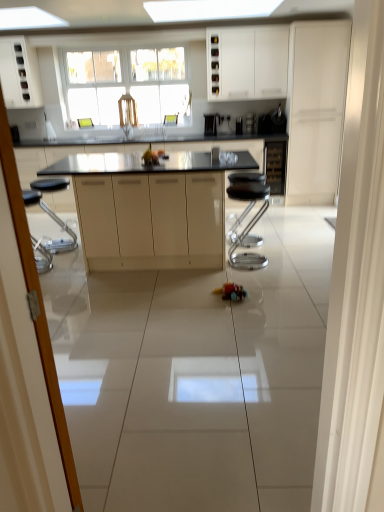
Question: Is white matte cabinet at upper left, placed as the first cabinetry when sorted from left to right, at the right side of white matte cabinet at right, which is the 1th cabinetry in right-to-left order?

Choices:
 (A) no
 (B) yes

Answer: (A)

Question: Does white matte cabinet at upper left, the 5th cabinetry positioned from the right, have a greater width compared to white matte cabinet at right, which ranks as the 5th cabinetry in left-to-right order?

Choices:
 (A) yes
 (B) no

Answer: (B)

Question: Is white matte cabinet at upper left, placed as the first cabinetry when sorted from left to right, taller than white matte cabinet at right, which is the 1th cabinetry in right-to-left order?

Choices:
 (A) yes
 (B) no

Answer: (B)

Question: Are white matte cabinet at upper left, the 5th cabinetry positioned from the right, and white matte cabinet at right, which ranks as the 5th cabinetry in left-to-right order, beside each other?

Choices:
 (A) no
 (B) yes

Answer: (A)

Question: Is white matte cabinet at upper left, placed as the first cabinetry when sorted from left to right, shorter than white matte cabinet at right, which is the 1th cabinetry in right-to-left order?

Choices:
 (A) no
 (B) yes

Answer: (B)

Question: From a real-world perspective, does white matte cabinet at upper left, the 5th cabinetry positioned from the right, stand above white matte cabinet at right, which is the 1th cabinetry in right-to-left order?

Choices:
 (A) no
 (B) yes

Answer: (B)

Question: From a real-world perspective, is matte beige cabinetry at center, the 4th cabinetry in the right-to-left sequence, positioned over transparent glass screen door at left based on gravity?

Choices:
 (A) yes
 (B) no

Answer: (B)

Question: From a real-world perspective, is matte beige cabinetry at center, arranged as the 2th cabinetry when viewed from the left, positioned under transparent glass screen door at left based on gravity?

Choices:
 (A) no
 (B) yes

Answer: (B)

Question: Considering the relative positions of matte beige cabinetry at center, arranged as the 2th cabinetry when viewed from the left, and transparent glass screen door at left in the image provided, is matte beige cabinetry at center, arranged as the 2th cabinetry when viewed from the left, in front of transparent glass screen door at left?

Choices:
 (A) no
 (B) yes

Answer: (A)

Question: Is transparent glass screen door at left surrounded by matte beige cabinetry at center, arranged as the 2th cabinetry when viewed from the left?

Choices:
 (A) yes
 (B) no

Answer: (B)

Question: From the image's perspective, is matte beige cabinetry at center, arranged as the 2th cabinetry when viewed from the left, located above transparent glass screen door at left?

Choices:
 (A) yes
 (B) no

Answer: (A)

Question: Can you confirm if matte beige cabinetry at center, the 4th cabinetry in the right-to-left sequence, is thinner than transparent glass screen door at left?

Choices:
 (A) yes
 (B) no

Answer: (B)

Question: From a real-world perspective, is white matte cabinet at upper left, the 5th cabinetry positioned from the right, physically below shiny plastic toy car at center?

Choices:
 (A) yes
 (B) no

Answer: (B)